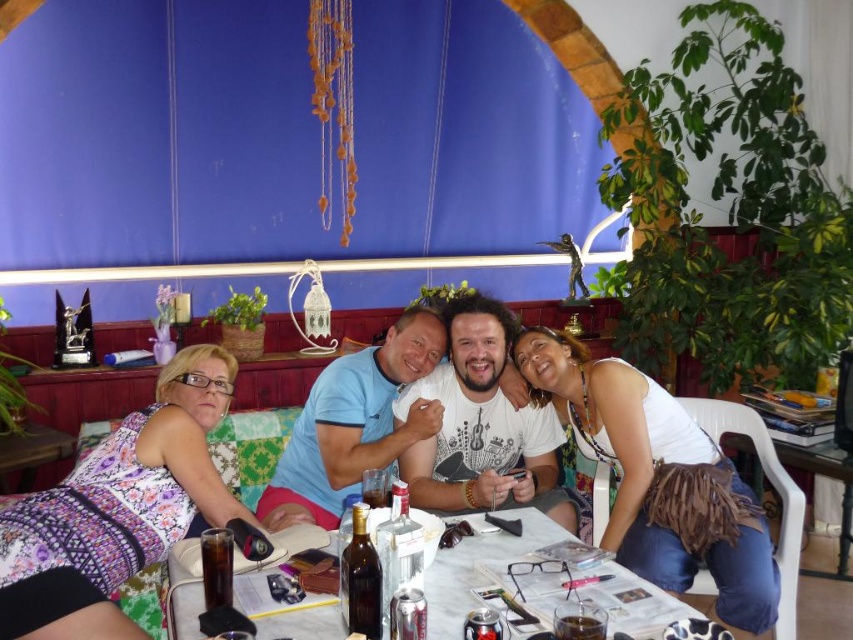
You are a customer at this restaurant and want to sit down. You have a large backpack that needs to fit under the white marble table at center. The backpack is the same size as the white tank top at center. Will the backpack fit under the table?

The white tank top at center is larger than the white marble table at center. Since your backpack is the same size as the white tank top at center, it will not fit under the white marble table at center.